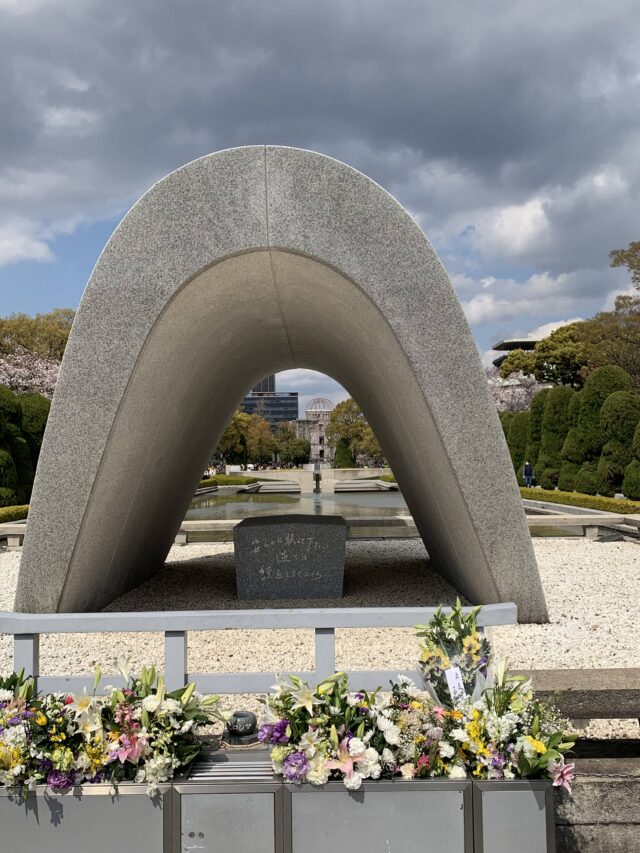
Locate an element on the screen. bench is located at coordinates (259, 753).